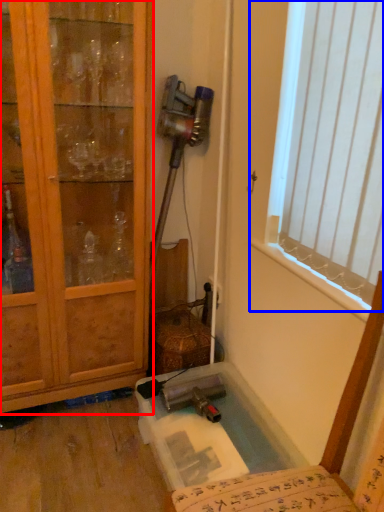
Question: Which object is further to the camera taking this photo, cabinetry (highlighted by a red box) or window (highlighted by a blue box)?

Choices:
 (A) cabinetry
 (B) window

Answer: (A)